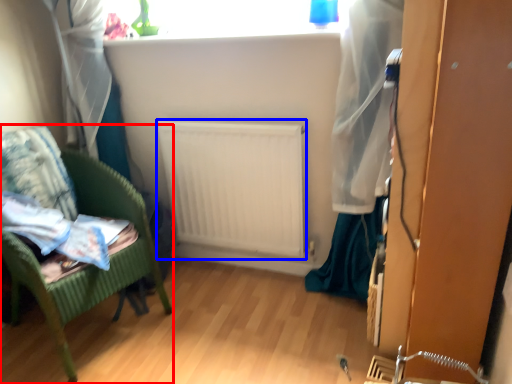
Question: Which point is further to the camera, furniture (highlighted by a red box) or radiator (highlighted by a blue box)?

Choices:
 (A) furniture
 (B) radiator

Answer: (B)